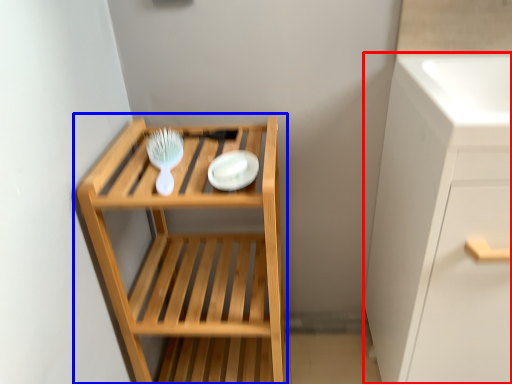
Question: Which of the following is the farthest to the observer, cabinetry (highlighted by a red box) or shelf (highlighted by a blue box)?

Choices:
 (A) cabinetry
 (B) shelf

Answer: (B)